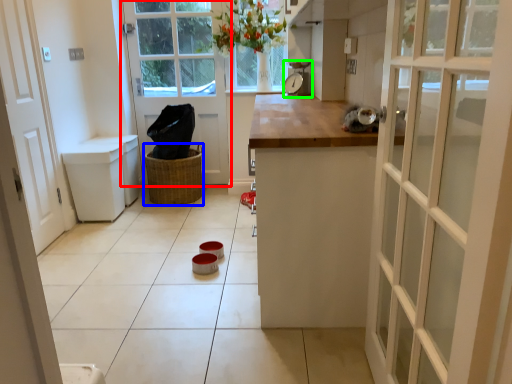
Question: Which object is positioned closest to door (highlighted by a red box)? Select from basket (highlighted by a blue box) and appliance (highlighted by a green box).

Choices:
 (A) basket
 (B) appliance

Answer: (A)